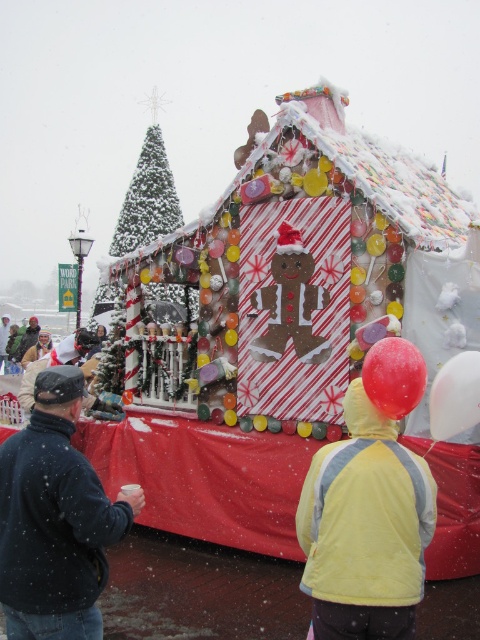
Question: Which point appears farthest from the camera in this image?

Choices:
 (A) (86, 518)
 (B) (432, 490)

Answer: (B)

Question: Which of the following is the closest to the observer?

Choices:
 (A) (59, 376)
 (B) (336, 580)

Answer: (B)

Question: Does black fleece jacket at lower left have a larger size compared to yellow fleece jacket at center?

Choices:
 (A) yes
 (B) no

Answer: (A)

Question: Is black fleece jacket at lower left to the right of yellow fleece jacket at center from the viewer's perspective?

Choices:
 (A) no
 (B) yes

Answer: (A)

Question: Does black fleece jacket at lower left lie in front of yellow fleece jacket at center?

Choices:
 (A) no
 (B) yes

Answer: (A)